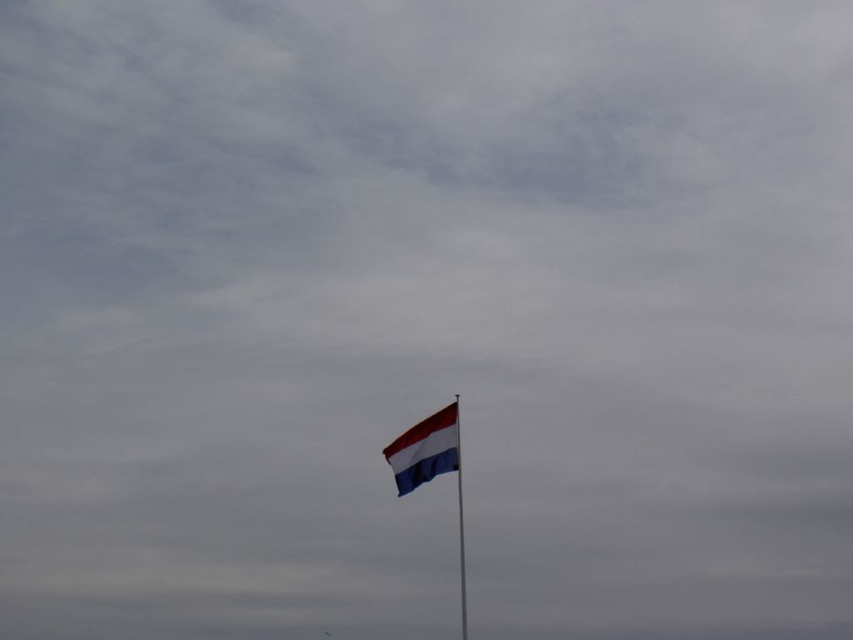
Question: Is the position of striped fabric flag at center less distant than that of metallic flag pole at center?

Choices:
 (A) no
 (B) yes

Answer: (B)

Question: Which of the following is the closest to the observer?

Choices:
 (A) (459, 486)
 (B) (398, 442)

Answer: (B)

Question: Is striped fabric flag at center further to camera compared to metallic flag pole at center?

Choices:
 (A) yes
 (B) no

Answer: (B)

Question: Which point is closer to the camera?

Choices:
 (A) (457, 403)
 (B) (450, 456)

Answer: (B)

Question: Which point appears farthest from the camera in this image?

Choices:
 (A) (403, 481)
 (B) (457, 472)

Answer: (A)

Question: Does striped fabric flag at center have a lesser width compared to metallic flag pole at center?

Choices:
 (A) yes
 (B) no

Answer: (B)